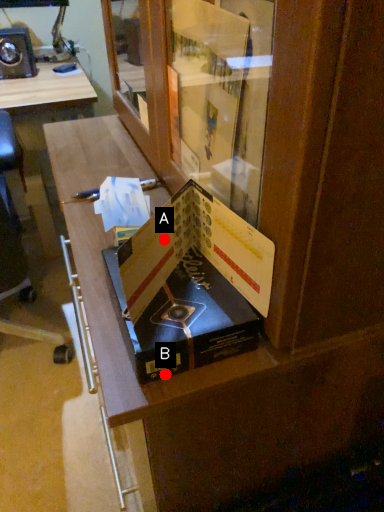
Question: Two points are circled on the image, labeled by A and B beside each circle. Among these points, which one is farthest from the camera?

Choices:
 (A) A is further
 (B) B is further

Answer: (A)